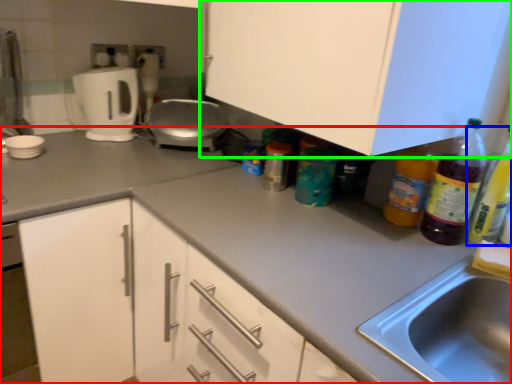
Question: Which object is the farthest from countertop (highlighted by a red box)? Choose among these: bottle (highlighted by a blue box) or cabinetry (highlighted by a green box).

Choices:
 (A) bottle
 (B) cabinetry

Answer: (A)